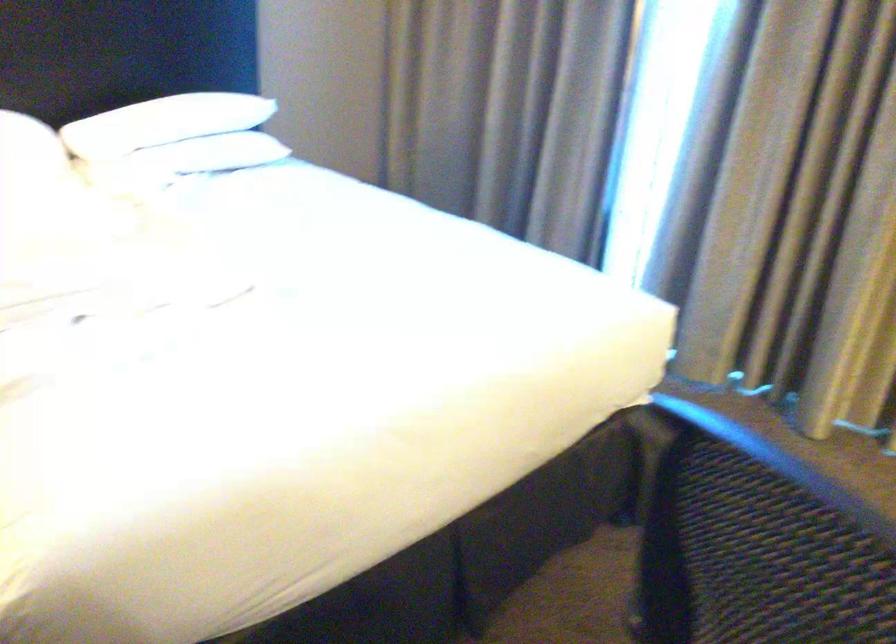
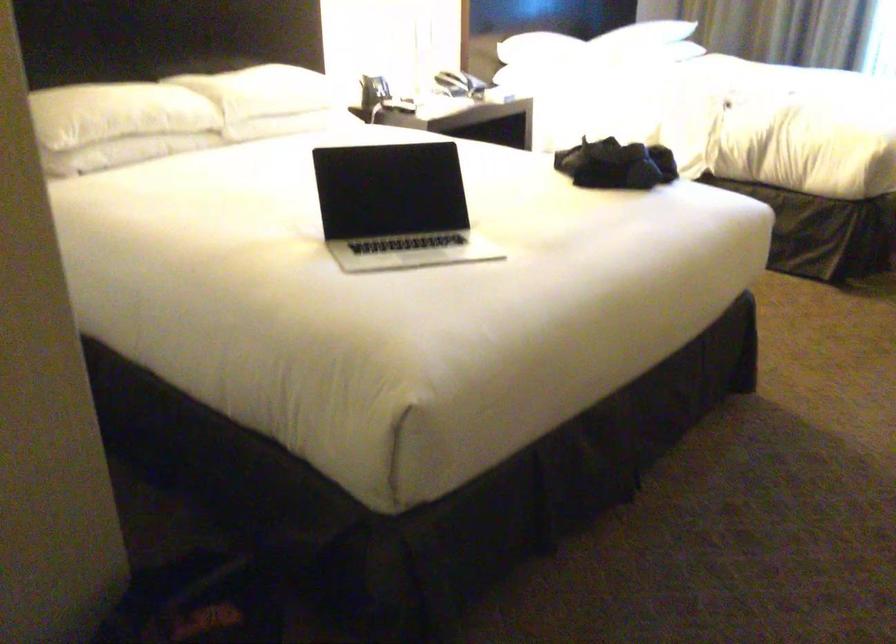
Which direction would the cameraman need to move to produce the second image?

The movement direction of the cameraman is left, backward.